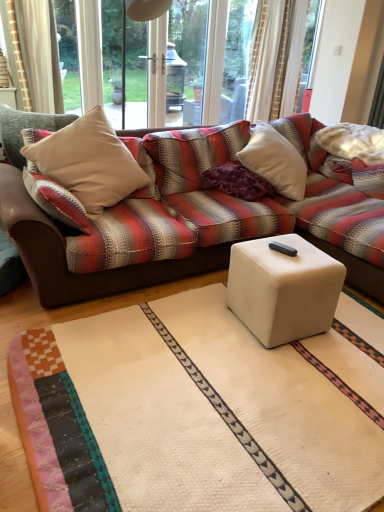
Question: Considering the positions of beige fabric pillow at left and transparent glass screen door at upper center in the image, is beige fabric pillow at left taller or shorter than transparent glass screen door at upper center?

Choices:
 (A) short
 (B) tall

Answer: (A)

Question: Do you think beige fabric pillow at left is within transparent glass screen door at upper center, or outside of it?

Choices:
 (A) outside
 (B) inside

Answer: (A)

Question: Estimate the real-world distances between objects in this image. Which object is farther from the transparent glass screen door at upper center?

Choices:
 (A) white matte cube at center
 (B) purple velvet pillow at center
 (C) beige fabric pillow at left

Answer: (A)

Question: Based on their relative distances, which object is nearer to the white matte cube at center?

Choices:
 (A) transparent glass screen door at upper center
 (B) beige fabric pillow at left
 (C) purple velvet pillow at center

Answer: (C)